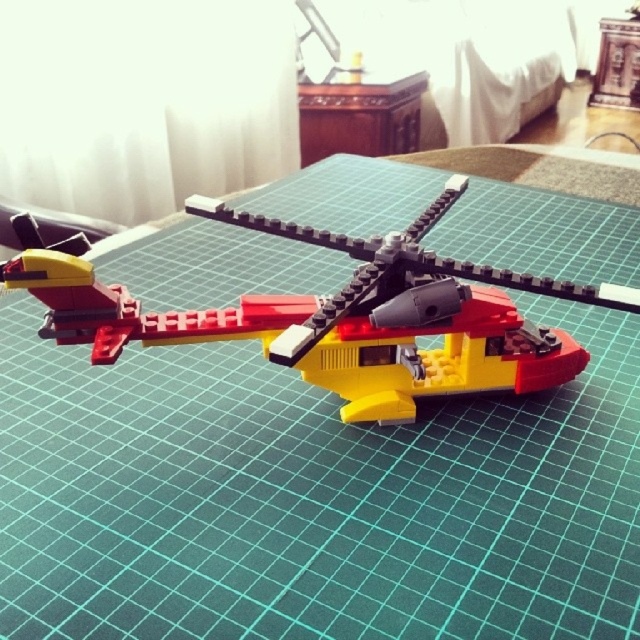
You are assembling a LEGO set and need to place the yellow plastic helicopter at center on the wooden table at center. According to the image, is the helicopter already positioned to the left or right of the table?

The yellow plastic helicopter at center is to the left of the wooden table at center, so it is positioned to the left of the table.

You are trying to determine if the yellow plastic helicopter at center will fit on a shelf that can only hold items smaller than the wooden table at center. Based on the scene, will the helicopter fit?

The yellow plastic helicopter at center is larger in size than the wooden table at center, so it will not fit on the shelf since it exceeds the size limit.

You are a toy designer looking at the LEGO helicopter model on the green cutting mat. Where exactly is the yellow plastic helicopter at center located on the mat?

The yellow plastic helicopter at center is located at point coordinates of (337, 314) on the mat.